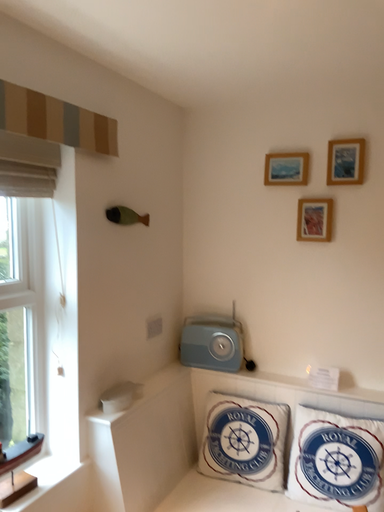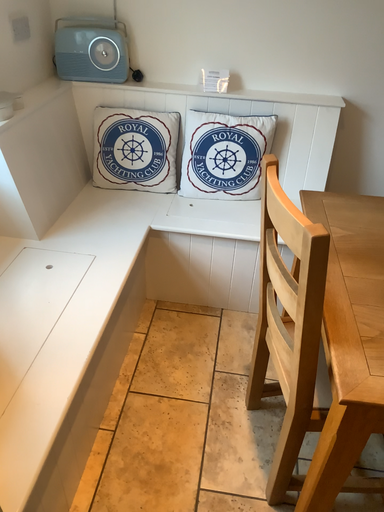
Question: Which way did the camera rotate in the video?

Choices:
 (A) rotated right
 (B) rotated left

Answer: (A)